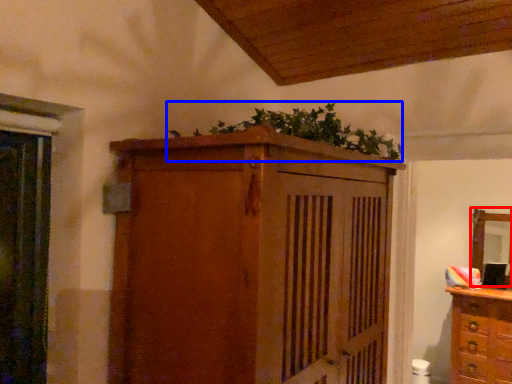
Question: Which object appears farthest to the camera in this image, mirror (highlighted by a red box) or plant (highlighted by a blue box)?

Choices:
 (A) mirror
 (B) plant

Answer: (A)